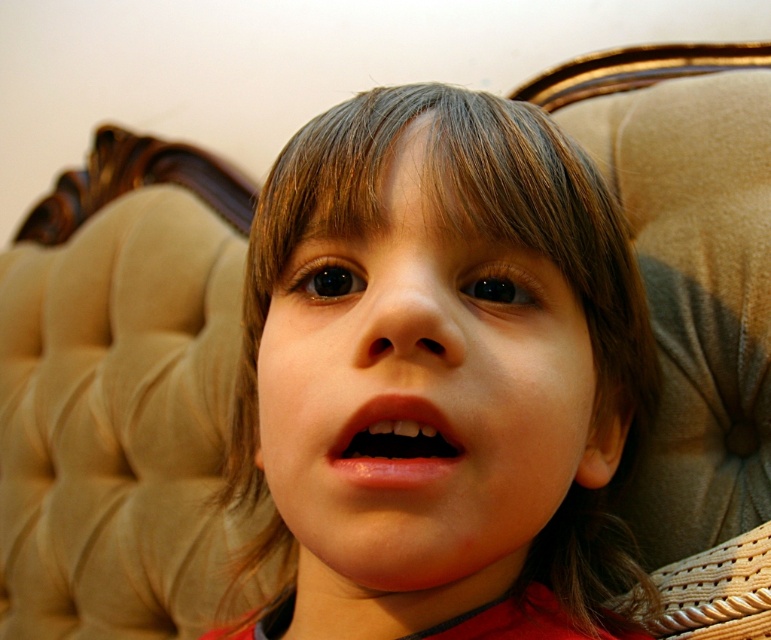
Between smooth skin face at center and pink glossy lips at center, which one has less height?

With less height is pink glossy lips at center.

Where is `smooth skin face at center`? smooth skin face at center is located at coordinates (421, 396).

This screenshot has height=640, width=771. What do you see at coordinates (421, 396) in the screenshot? I see `smooth skin face at center` at bounding box center [421, 396].

Find the location of `smooth skin face at center`. smooth skin face at center is located at coordinates (421, 396).